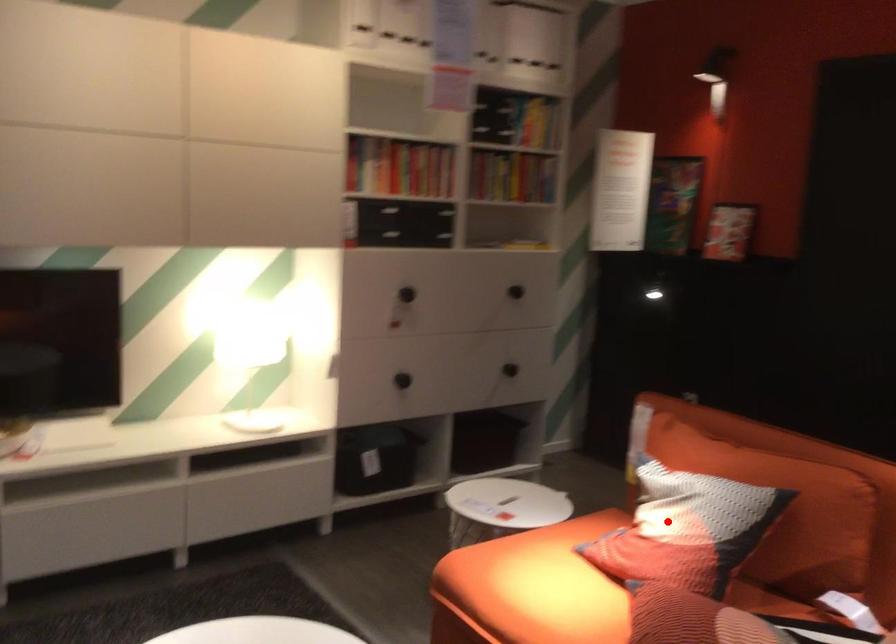
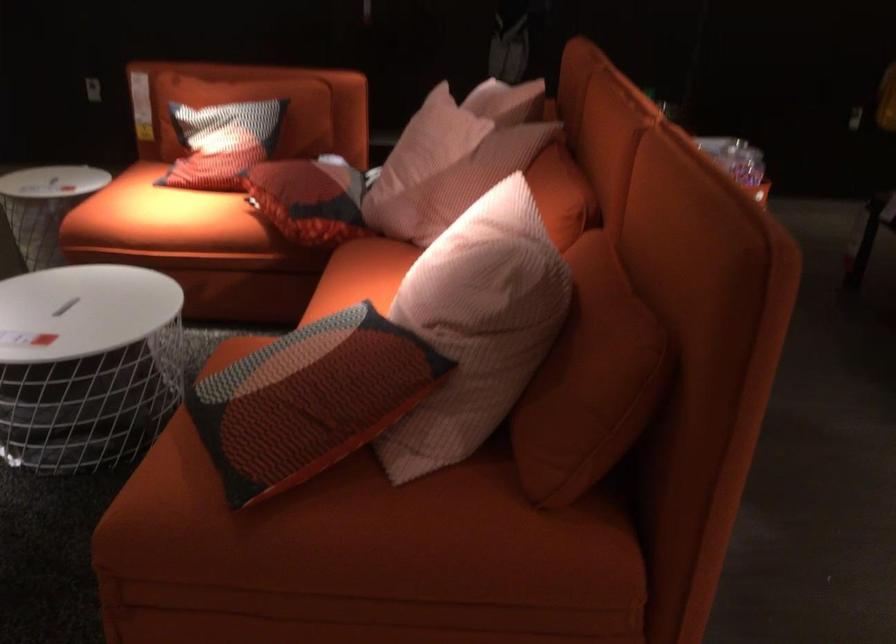
Find the pixel in the second image that matches the highlighted location in the first image.

(222, 142)